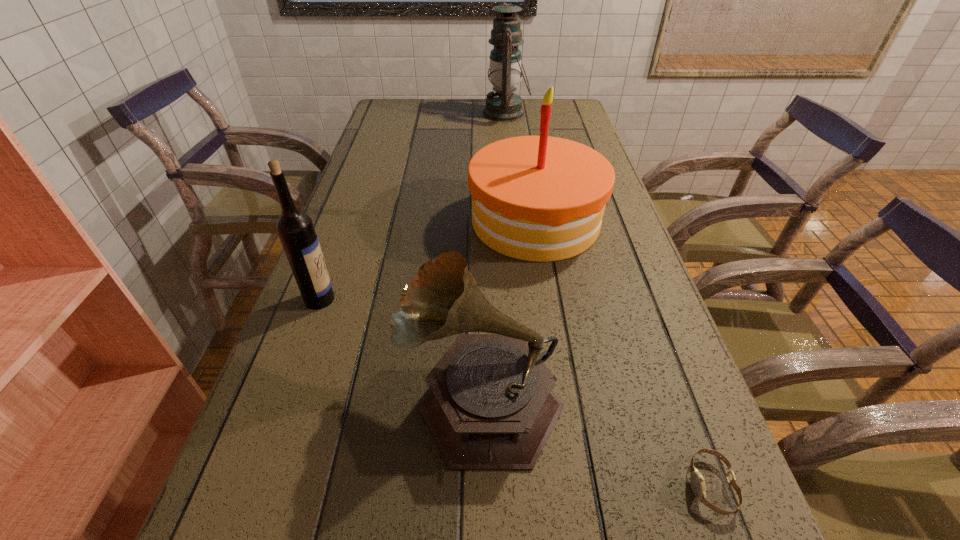
Image resolution: width=960 pixels, height=540 pixels. I want to click on vacant space at the left edge, so click(334, 307).

The height and width of the screenshot is (540, 960). What are the coordinates of `vacant region at the right edge of the desktop` in the screenshot? It's located at (686, 447).

I want to click on vacant area at the far left corner of the desktop, so click(406, 110).

This screenshot has height=540, width=960. Identify the location of free space between the second farthest object and the third nearest object. click(427, 260).

Locate an element on the screen. This screenshot has height=540, width=960. free space between the birthday cake and the shortest object is located at coordinates (623, 353).

At what (x,y) coordinates should I click in order to perform the action: click on free space between the third farthest object and the second farthest object. Please return your answer as a coordinate pair (x, y). This screenshot has height=540, width=960. Looking at the image, I should click on (427, 260).

Identify the location of vacant area that lies between the farthest object and the third farthest object. (413, 206).

Image resolution: width=960 pixels, height=540 pixels. Identify the location of free spot between the leftmost object and the fourth tallest object. (400, 348).

At what (x,y) coordinates should I click in order to perform the action: click on free space between the oil lamp and the wine bottle. Please return your answer as a coordinate pair (x, y). The height and width of the screenshot is (540, 960). Looking at the image, I should click on (413, 206).

At what (x,y) coordinates should I click in order to perform the action: click on free space between the second farthest object and the phonograph record. Please return your answer as a coordinate pair (x, y). Looking at the image, I should click on (508, 309).